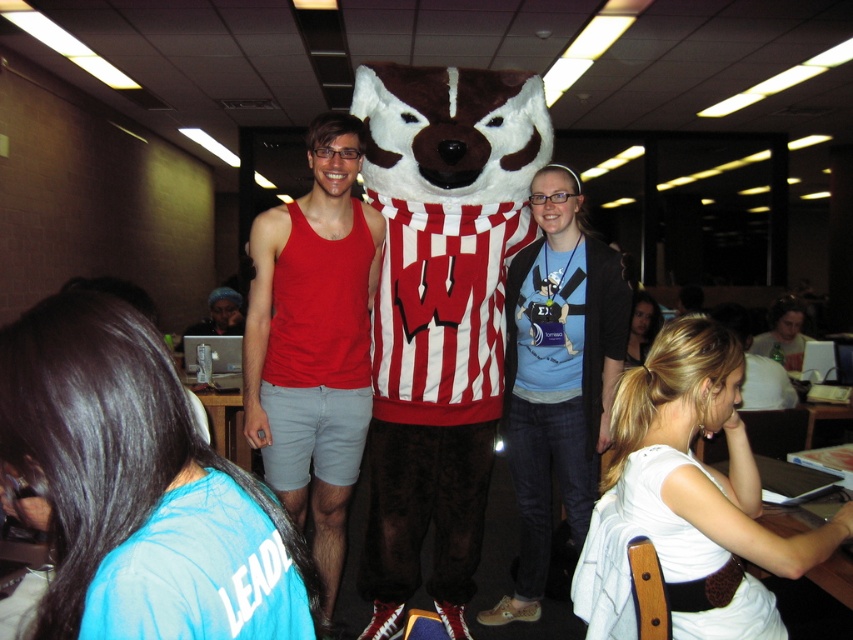
You are a photographer trying to capture a closeup shot of the white fabric shirt at lower right and the smooth black hair at lower right. Which object should you focus on first if you want to ensure both are in focus without adjusting the camera settings?

The white fabric shirt at lower right is located below smooth black hair at lower right, so you should focus on the smooth black hair at lower right first since it is closer to the camera.

You are a student trying to locate your matte black laptop at left in a classroom. The teacher says it is near the point marked at coordinate [221,314]. Can you confirm the location of your matte black laptop at left based on the given coordinate?

The point at coordinate [221,314] marks the location of the matte black laptop at left, so yes, the laptop is located there.